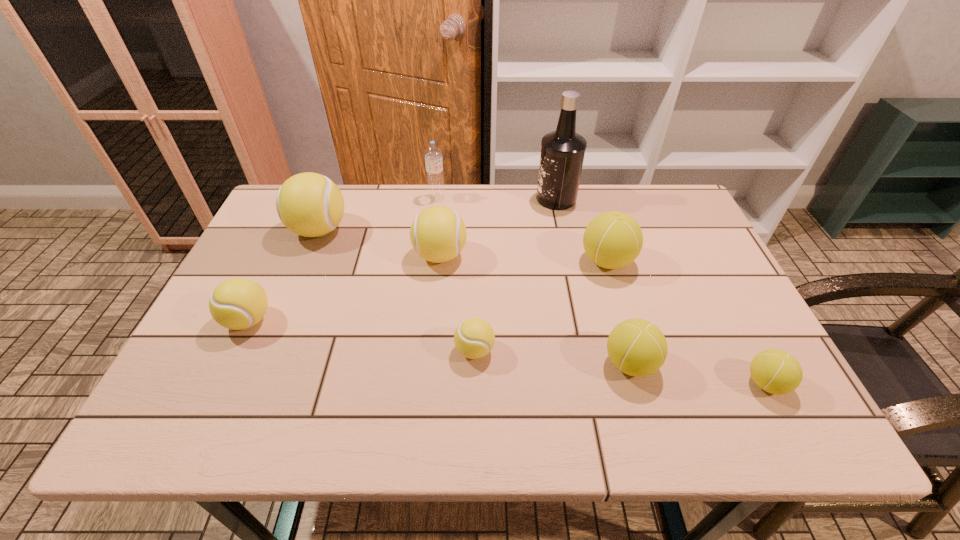
This screenshot has width=960, height=540. I want to click on vacant area situated on the left of the smallest yellow tennis ball, so click(335, 350).

Where is `blank space located on the left of the rightmost object`? The image size is (960, 540). blank space located on the left of the rightmost object is located at coordinates (640, 383).

Where is `liquor present at the far edge`? Image resolution: width=960 pixels, height=540 pixels. liquor present at the far edge is located at coordinates (562, 153).

Identify the location of water bottle located at the far edge. Image resolution: width=960 pixels, height=540 pixels. (433, 154).

Locate an element on the screen. This screenshot has height=540, width=960. tennis ball that is at the far edge is located at coordinates (309, 204).

This screenshot has height=540, width=960. In order to click on object located in the near edge section of the desktop in this screenshot , I will do `click(775, 371)`.

Locate an element on the screen. object at the right edge is located at coordinates (775, 371).

The height and width of the screenshot is (540, 960). Identify the location of object situated at the far left corner. (309, 204).

The width and height of the screenshot is (960, 540). In order to click on object located at the near right corner in this screenshot , I will do click(x=775, y=371).

Locate an element on the screen. free point at the far edge is located at coordinates (509, 186).